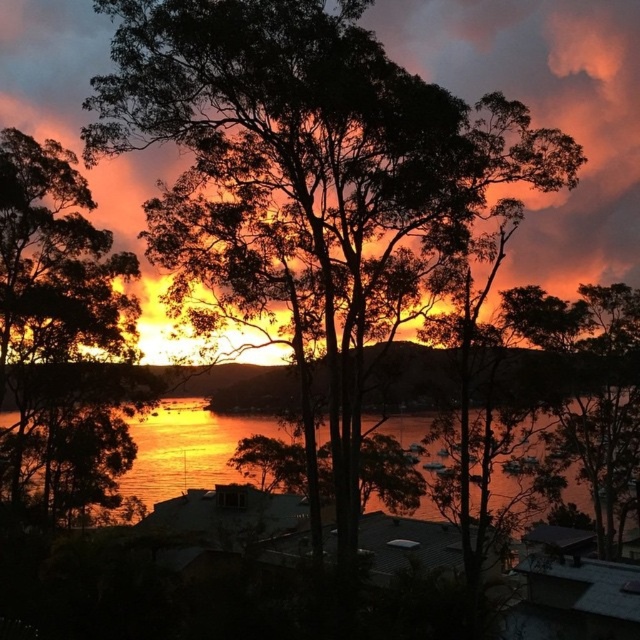
You are standing on the shore looking at the silhouette leafy tree at left and the glistening water at center. Which object is closer to you?

The silhouette leafy tree at left is closer to you because it is positioned further to the viewer than the glistening water at center, meaning it appears nearer in the scene.

You are an artist planning to paint the sunset scene. You need to decide where to place the horizon line so that the orange matte cloud at upper center and the glistening water at center are both visible. Based on their positions, where should you draw the horizon line?

The orange matte cloud at upper center is much taller than the glistening water at center, so the horizon line should be placed below the cloud to ensure both elements are visible in the painting.